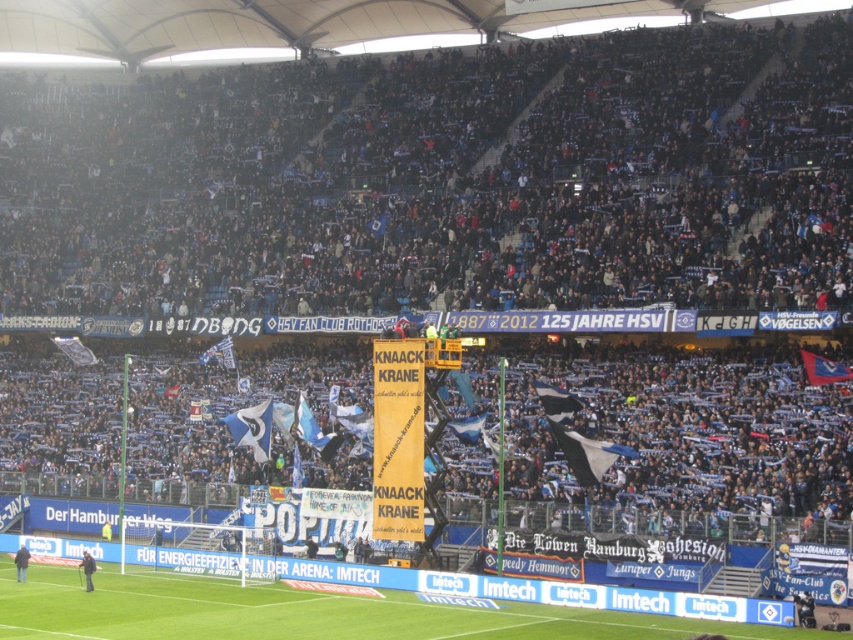
You are a photographer trying to capture the entire green grass football field at lower center and the blue fabric flag at center in a single shot. Based on their positions, which object should you position first in your camera frame to ensure both are included?

Since the green grass football field at lower center is to the right of the blue fabric flag at center, you should position the blue fabric flag at center first in your camera frame to ensure the green grass football field at lower center is also captured to its right.

You are a photographer at the stadium. You want to capture a wide shot that includes both the green grass football field at lower center and the blue fabric flag at center. Which object should you focus on first to ensure both are in frame?

The green grass football field at lower center has a larger width than the blue fabric flag at center, so focusing on the field first will allow the flag to fit into the frame more easily.

Please provide the coordinates of the dark blue fabric crowd at upper center in the image. The coordinates should be in the format of a tuple with two decimal numbers separated by a comma, enclosed in parentheses.

The coordinates of the dark blue fabric crowd at upper center are at point (427, 179).